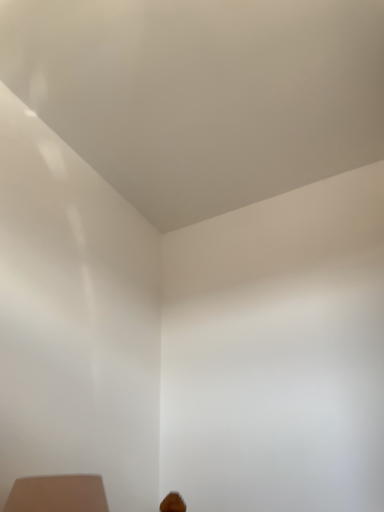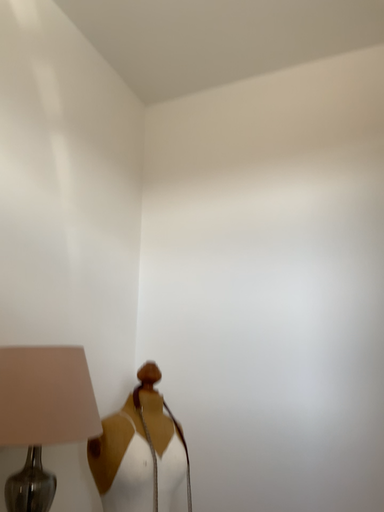
Question: Which way did the camera rotate in the video?

Choices:
 (A) rotated downward
 (B) rotated upward

Answer: (A)